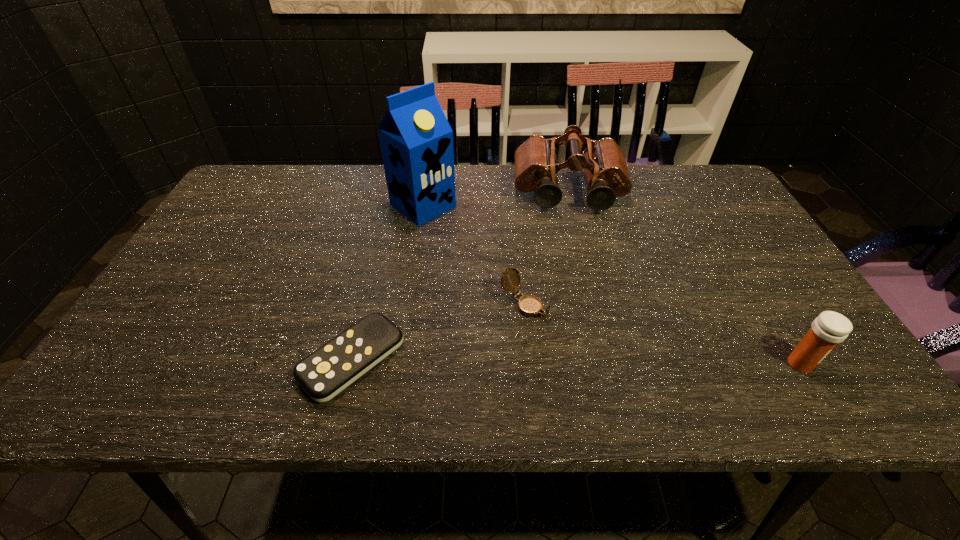
This screenshot has height=540, width=960. In order to click on free space that satisfies the following two spatial constraints: 1. on the front side of the compass; 2. on the label side of the medicine in this screenshot , I will do `click(530, 364)`.

This screenshot has height=540, width=960. In order to click on free spot that satisfies the following two spatial constraints: 1. on the front side of the rightmost object; 2. on the label side of the second tallest object in this screenshot , I will do `click(613, 364)`.

The width and height of the screenshot is (960, 540). I want to click on free space that satisfies the following two spatial constraints: 1. on the back side of the compass; 2. on the right side of the binoculars, so click(514, 193).

I want to click on vacant space that satisfies the following two spatial constraints: 1. on the front side of the third tallest object; 2. on the label side of the remote control, so click(351, 364).

In order to click on vacant region that satisfies the following two spatial constraints: 1. on the back side of the compass; 2. on the right side of the binoculars in this screenshot , I will do `click(514, 193)`.

Image resolution: width=960 pixels, height=540 pixels. Find the location of `free location that satisfies the following two spatial constraints: 1. on the back side of the second tallest object; 2. on the left side of the carton`. free location that satisfies the following two spatial constraints: 1. on the back side of the second tallest object; 2. on the left side of the carton is located at coordinates (425, 193).